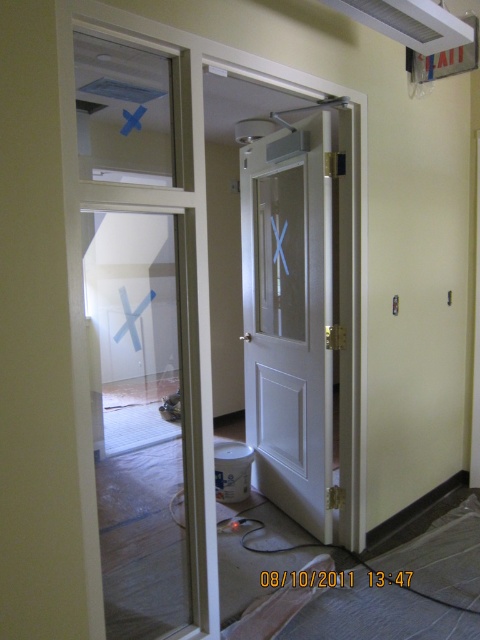
Between clear glass door at center and white glossy door at center, which one is positioned higher?

white glossy door at center

Which is more to the right, clear glass door at center or white glossy door at center?

white glossy door at center is more to the right.

Which is behind, point (109, 390) or point (286, 413)?

Point (286, 413)

This screenshot has width=480, height=640. Identify the location of clear glass door at center. (136, 419).